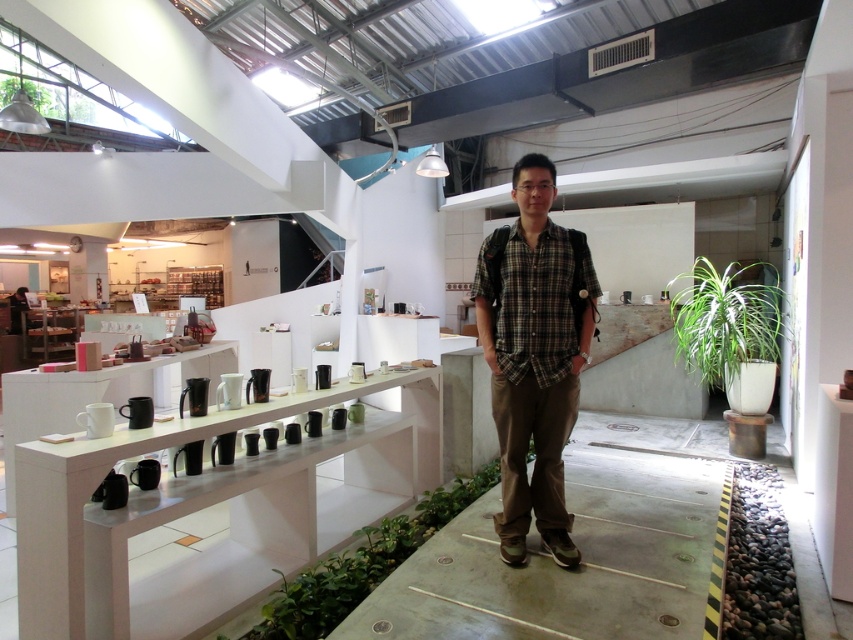
Who is positioned more to the right, plaid cotton shirt at center or green leafy plant at right?

From the viewer's perspective, green leafy plant at right appears more on the right side.

Is plaid cotton shirt at center shorter than green leafy plant at right?

Incorrect, plaid cotton shirt at center's height does not fall short of green leafy plant at right's.

Image resolution: width=853 pixels, height=640 pixels. What do you see at coordinates (534, 355) in the screenshot?
I see `plaid cotton shirt at center` at bounding box center [534, 355].

Where is `plaid cotton shirt at center`? This screenshot has height=640, width=853. plaid cotton shirt at center is located at coordinates (534, 355).